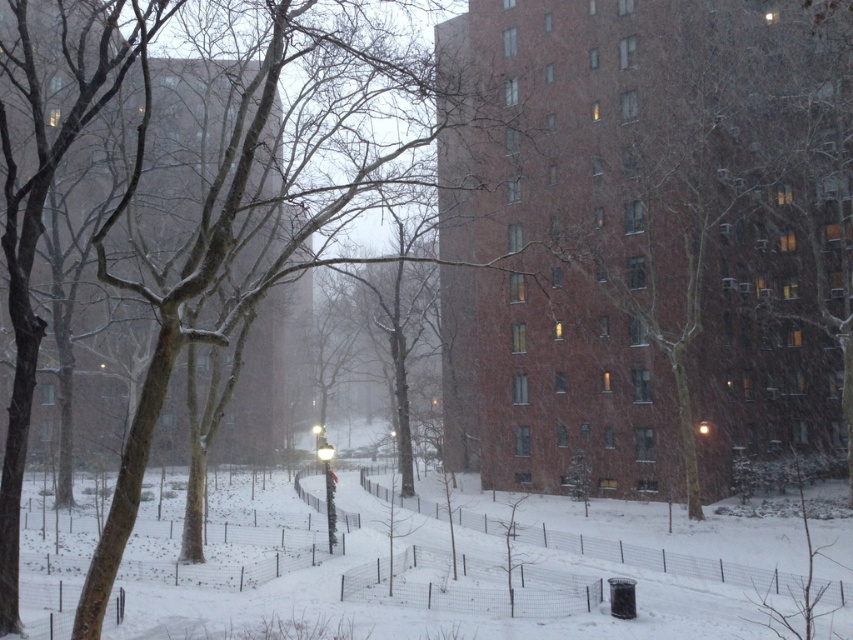
Can you confirm if brown bark tree at center is shorter than white fluffy snow at center?

Incorrect, brown bark tree at center's height does not fall short of white fluffy snow at center's.

Is brown bark tree at center positioned behind white fluffy snow at center?

No, brown bark tree at center is in front of white fluffy snow at center.

Which is in front, point (397, 92) or point (397, 625)?

Positioned in front is point (397, 625).

Where is `brown bark tree at center`? Image resolution: width=853 pixels, height=640 pixels. brown bark tree at center is located at coordinates (196, 225).

Does point (778, 192) come in front of point (274, 500)?

Yes, it is.

Where is `bare branches at center`? The image size is (853, 640). bare branches at center is located at coordinates (724, 180).

You are a GUI agent. You are given a task and a screenshot of the screen. Output one action in this format:
    pyautogui.click(x=<x>, y=<y>)
    Task: Click on the bare branches at center
    The image size is (853, 640).
    Given the screenshot: What is the action you would take?
    pyautogui.click(x=724, y=180)

Can you confirm if bare branches at center is smaller than brown bark tree at center?

Correct, bare branches at center occupies less space than brown bark tree at center.

Between bare branches at center and brown bark tree at center, which one is positioned lower?

bare branches at center is below.

Locate an element on the screen. bare branches at center is located at coordinates (724, 180).